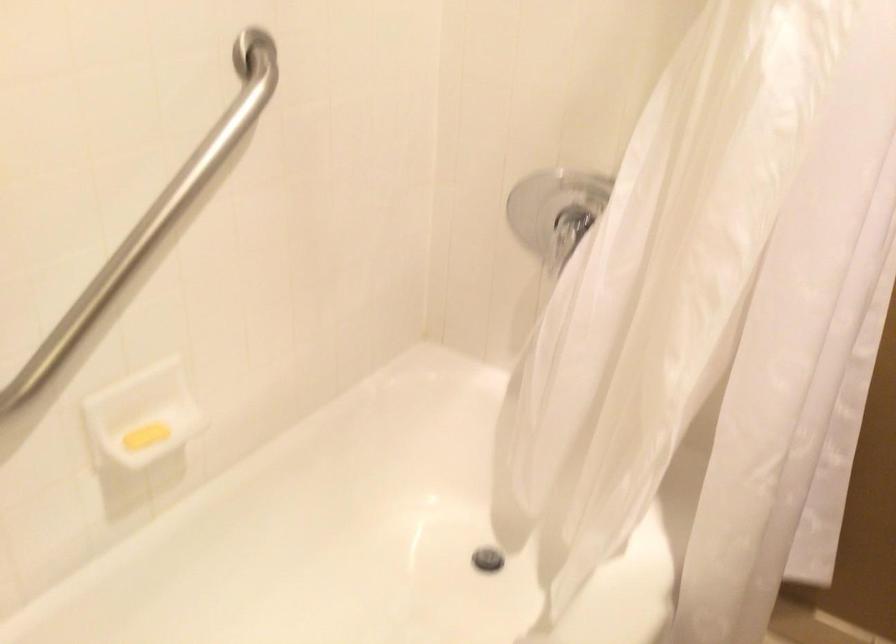
The height and width of the screenshot is (644, 896). Describe the element at coordinates (570, 232) in the screenshot. I see `the shower faucet handle` at that location.